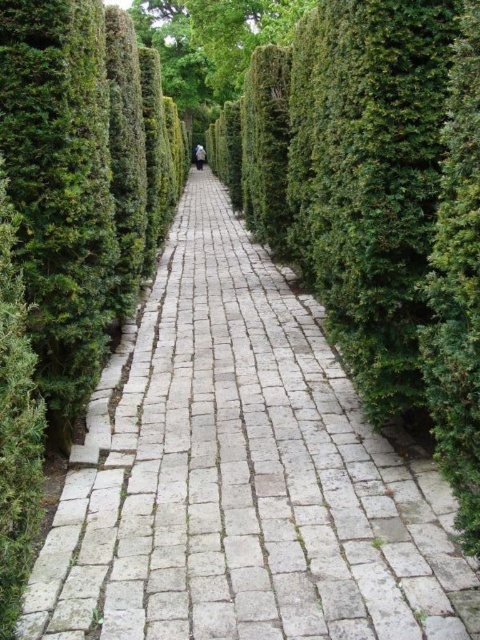
You are a gardener who needs to walk along the pathway while avoiding the green textured hedge at upper center. Given that the white stone pavement at center is wider than the hedge, can you safely walk along the path without stepping onto the hedge?

The white stone pavement at center is wider than the green textured hedge at upper center, so yes, you can safely walk along the path without stepping onto the hedge.

You are standing on the white stone pavement at center and want to reach the green textured hedge at upper center. Which direction should you move to get closer to the hedge?

You should move forward towards the green textured hedge at upper center since the white stone pavement at center is in front of it.

You are standing at the starting point of the pathway and want to place a decorative statue exactly at the center of the white stone pavement at center. According to the coordinates provided, where should you place the statue?

The statue should be placed at the coordinates point (241,476) where the white stone pavement at center is located.